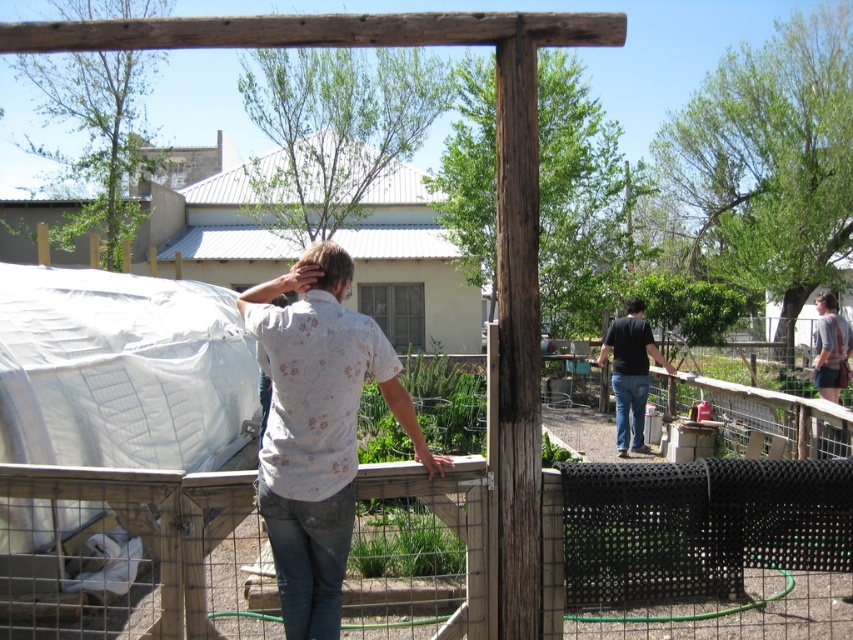
Is floral shirt at center wider than striped shirt at upper right?

In fact, floral shirt at center might be narrower than striped shirt at upper right.

Does floral shirt at center have a greater height compared to striped shirt at upper right?

Indeed, floral shirt at center has a greater height compared to striped shirt at upper right.

Measure the distance between point (273, 522) and camera.

Point (273, 522) and camera are 11.64 feet apart from each other.

This screenshot has height=640, width=853. Find the location of `floral shirt at center`. floral shirt at center is located at coordinates (317, 428).

Is black matte shirt at right below striped shirt at upper right?

Indeed, black matte shirt at right is positioned under striped shirt at upper right.

Which is below, black matte shirt at right or striped shirt at upper right?

black matte shirt at right is below.

The width and height of the screenshot is (853, 640). Identify the location of black matte shirt at right. (630, 371).

Is floral shirt at center smaller than black matte shirt at right?

Correct, floral shirt at center occupies less space than black matte shirt at right.

The height and width of the screenshot is (640, 853). I want to click on floral shirt at center, so click(317, 428).